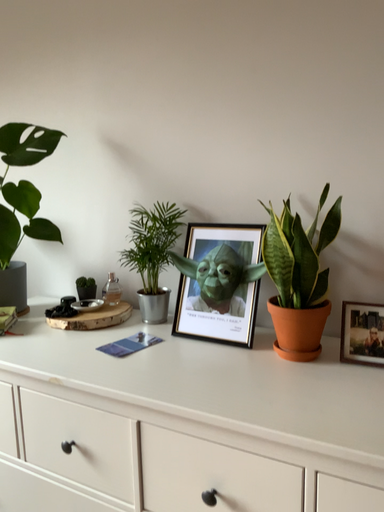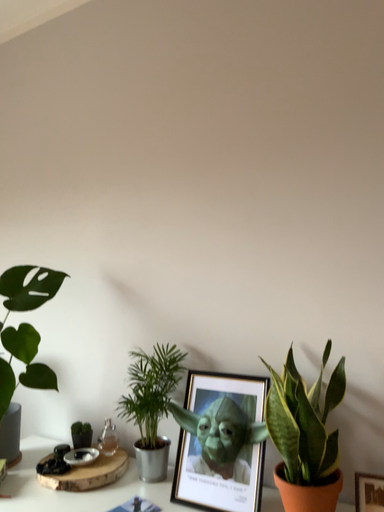
Question: How did the camera likely rotate when shooting the video?

Choices:
 (A) rotated downward
 (B) rotated upward

Answer: (B)